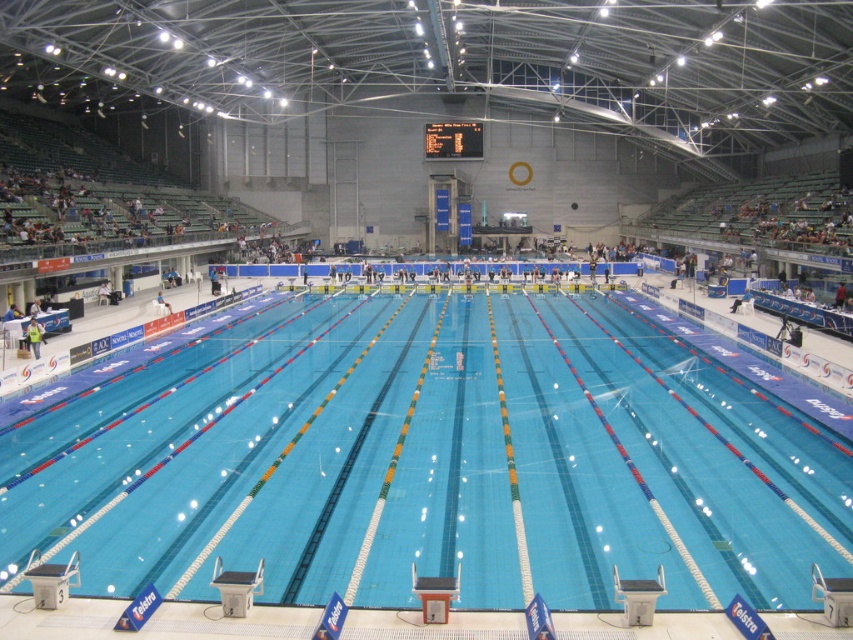
Question: Does clear blue water at center come in front of light blue fabric shirt at lower left?

Choices:
 (A) no
 (B) yes

Answer: (B)

Question: Which point is closer to the camera taking this photo?

Choices:
 (A) (32, 348)
 (B) (714, 518)

Answer: (B)

Question: Is clear blue water at center smaller than light blue fabric shirt at lower left?

Choices:
 (A) no
 (B) yes

Answer: (A)

Question: Can you confirm if clear blue water at center is wider than light blue fabric shirt at lower left?

Choices:
 (A) yes
 (B) no

Answer: (A)